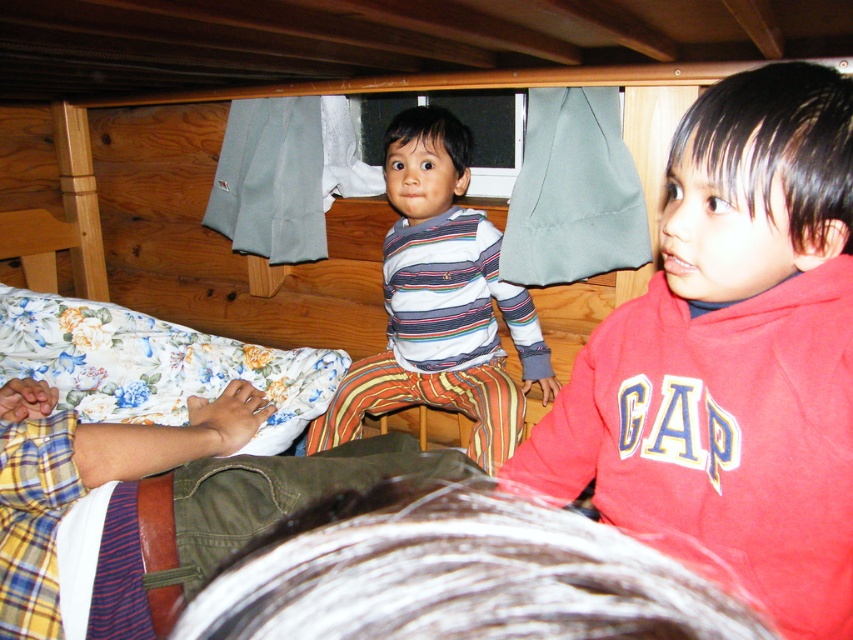
You are standing in the cabin and want to grab the red cotton hoodie at upper right. Based on its 2D coordinates, in which general direction should you look to find it?

The red cotton hoodie at upper right is located at coordinates 0.553 on the x axis and 0.860 on the y axis, so you should look towards the upper right direction to find it.

You are helping a child get dressed and have two options available. The red cotton hoodie at upper right and the striped cotton shirt at center. Which clothing item is shorter in length?

The red cotton hoodie at upper right is shorter than the striped cotton shirt at center.

You are helping organize a closet. You need to hang the red cotton hoodie at upper right and the striped cotton shirt at center. According to the image, which item should be placed higher on the hanger to match their positions in the scene?

The striped cotton shirt at center should be placed higher on the hanger because, in the image, the red cotton hoodie at upper right is located below it.